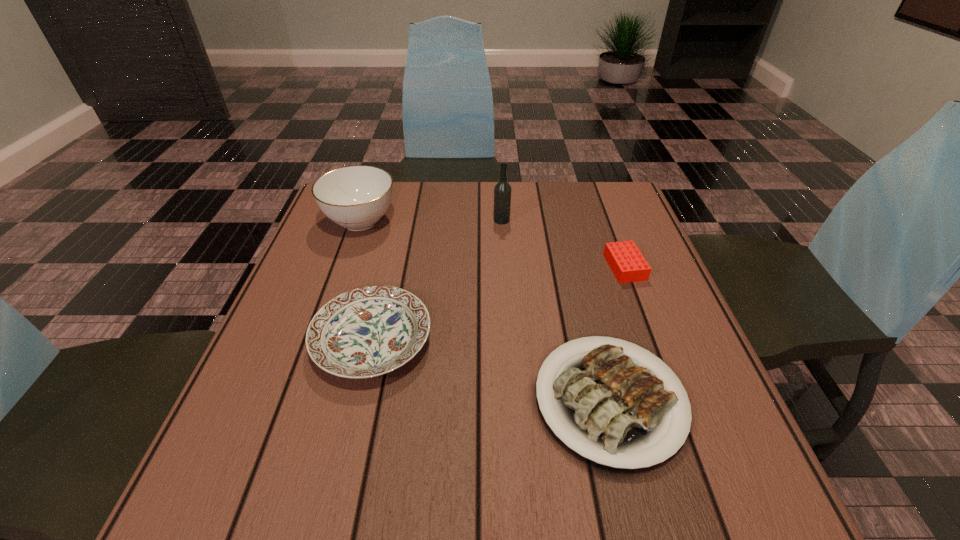
In order to click on vacant area at the near edge of the desktop in this screenshot , I will do `click(471, 510)`.

In the image, there is a desktop. Where is `vacant area at the left edge`? This screenshot has height=540, width=960. vacant area at the left edge is located at coordinates (302, 355).

Image resolution: width=960 pixels, height=540 pixels. In the image, there is a desktop. Find the location of `vacant space at the right edge`. vacant space at the right edge is located at coordinates (660, 286).

In the image, there is a desktop. At what (x,y) coordinates should I click in order to perform the action: click on vacant area at the near left corner. Please return your answer as a coordinate pair (x, y). This screenshot has width=960, height=540. Looking at the image, I should click on (228, 477).

The width and height of the screenshot is (960, 540). In the image, there is a desktop. What are the coordinates of `vacant space at the far right corner` in the screenshot? It's located at (609, 206).

This screenshot has width=960, height=540. Identify the location of vacant area between the second tallest object and the left plate. (x=367, y=281).

The width and height of the screenshot is (960, 540). Identify the location of empty space that is in between the left plate and the right plate. (491, 370).

Find the location of a particular element. The image size is (960, 540). vacant space that is in between the vodka and the right plate is located at coordinates (556, 310).

In order to click on empty space between the right plate and the Lego in this screenshot , I will do `click(617, 334)`.

Where is `vacant space that's between the vodka and the right plate`? vacant space that's between the vodka and the right plate is located at coordinates (556, 310).